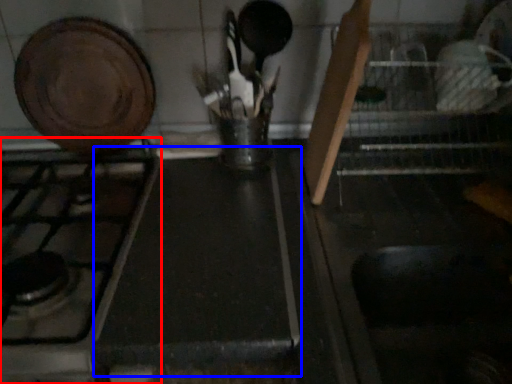
Question: Which of the following is the farthest to the observer, gas stove (highlighted by a red box) or counter top (highlighted by a blue box)?

Choices:
 (A) gas stove
 (B) counter top

Answer: (B)